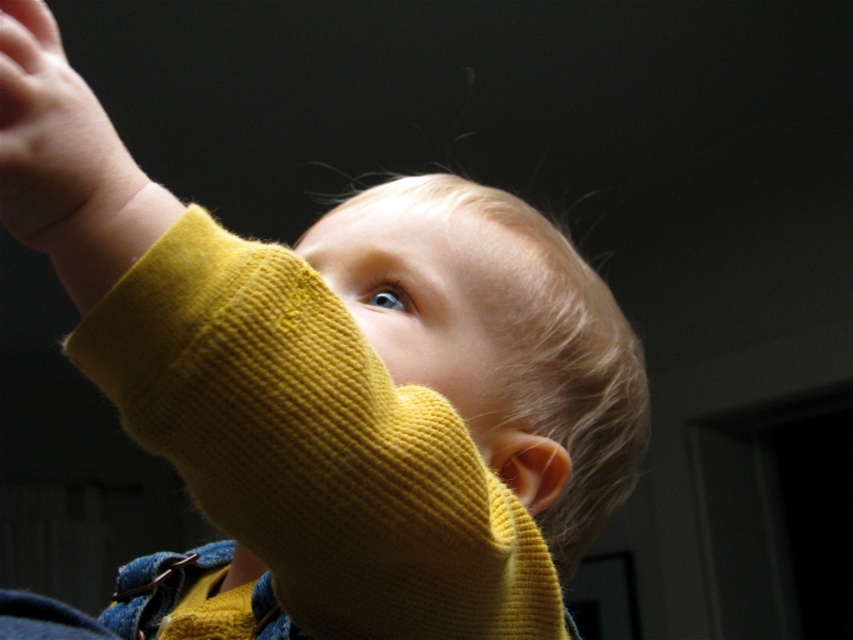
Question: From the image, what is the correct spatial relationship of smooth yellow sweater at center in relation to smooth yellow sleeve at upper left?

Choices:
 (A) below
 (B) above

Answer: (A)

Question: Which point is farther to the camera?

Choices:
 (A) (125, 205)
 (B) (450, 284)

Answer: (B)

Question: Does smooth yellow sweater at center appear under smooth yellow sleeve at upper left?

Choices:
 (A) yes
 (B) no

Answer: (A)

Question: Which of the following is the closest to the observer?

Choices:
 (A) smooth yellow sweater at center
 (B) smooth yellow sleeve at upper left

Answer: (B)

Question: Which of the following is the closest to the observer?

Choices:
 (A) smooth yellow sleeve at upper left
 (B) smooth yellow sweater at center

Answer: (A)

Question: Is smooth yellow sweater at center closer to camera compared to smooth yellow sleeve at upper left?

Choices:
 (A) no
 (B) yes

Answer: (A)